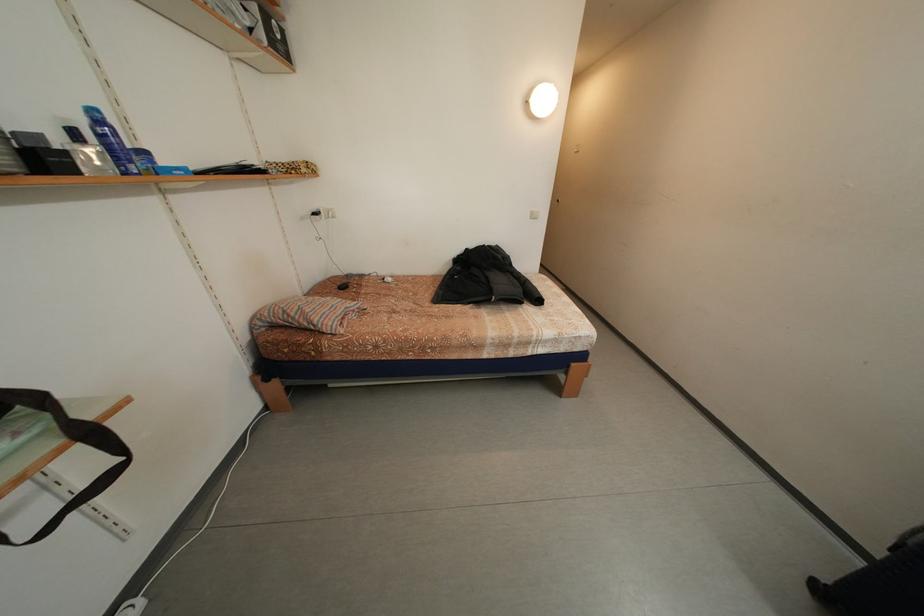
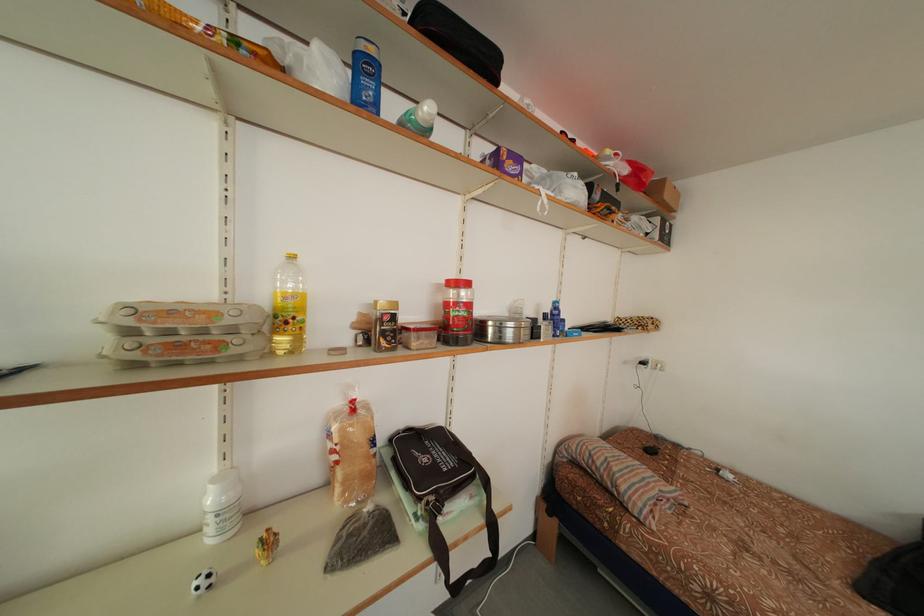
Question: The camera is either moving clockwise (left) or counter-clockwise (right) around the object. The first image is from the beginning of the video and the second image is from the end. Is the camera moving left or right when shooting the video?

Choices:
 (A) Left
 (B) Right

Answer: (B)